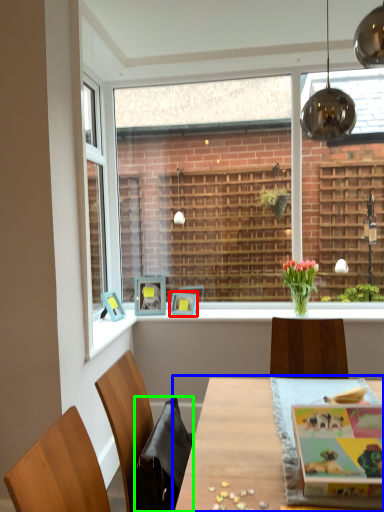
Question: Considering the real-world distances, which object is farthest from picture frame (highlighted by a red box)? table (highlighted by a blue box) or swivel chair (highlighted by a green box)?

Choices:
 (A) table
 (B) swivel chair

Answer: (B)